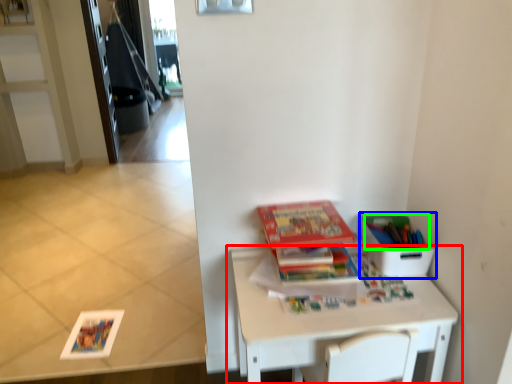
Question: Based on their relative distances, which object is nearer to table (highlighted by a red box)? Choose from cardboard box (highlighted by a blue box) and book (highlighted by a green box).

Choices:
 (A) cardboard box
 (B) book

Answer: (A)